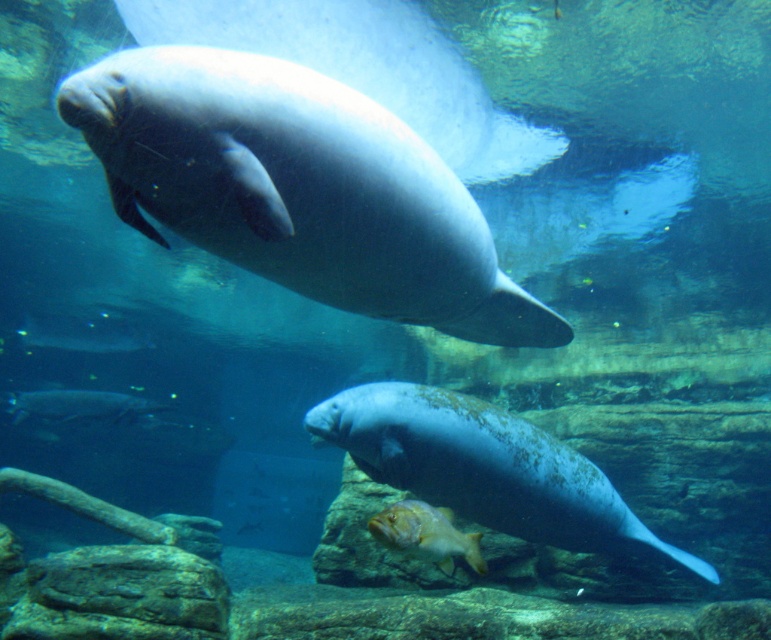
Based on the photo, you are a marine biologist observing this underwater scene. You notice the smooth gray manatee at upper center and the silvery metallic fish at lower left. Which of these two animals is closer to the surface of the water?

The smooth gray manatee at upper center is closer to the surface of the water because it is positioned in front of the silvery metallic fish at lower left, indicating it is nearer to the observer.

You are a marine biologist observing an underwater scene from a glass viewing area. You notice a smooth gray manatee at upper center. If your viewing area is 2 meters away from the manatee, can you safely observe it without disturbing it?

The distance between the smooth gray manatee at upper center and the viewer is 2.17 meters, which is slightly more than the 2 meters required for safe observation. Therefore, you can safely observe the smooth gray manatee at upper center without disturbing it.